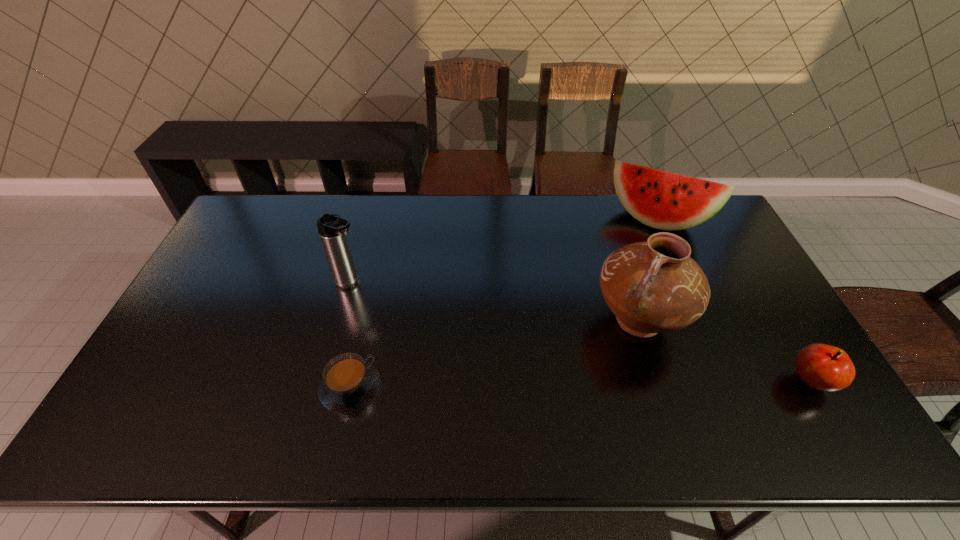
Locate an element on the screen. This screenshot has height=540, width=960. apple located in the right edge section of the desktop is located at coordinates tap(823, 367).

At what (x,y) coordinates should I click in order to perform the action: click on watermelon located at the right edge. Please return your answer as a coordinate pair (x, y). Looking at the image, I should click on (663, 200).

This screenshot has height=540, width=960. What are the coordinates of `object at the far right corner` in the screenshot? It's located at (663, 200).

Locate an element on the screen. The height and width of the screenshot is (540, 960). object that is at the near right corner is located at coordinates (823, 367).

This screenshot has width=960, height=540. I want to click on free space at the far edge, so click(x=288, y=234).

At what (x,y) coordinates should I click in order to perform the action: click on vacant space at the near edge. Please return your answer as a coordinate pair (x, y). Looking at the image, I should click on (260, 376).

Identify the location of free space at the left edge of the desktop. (227, 300).

The height and width of the screenshot is (540, 960). I want to click on free space at the far left corner, so click(x=246, y=217).

This screenshot has height=540, width=960. I want to click on vacant space at the near left corner of the desktop, so click(x=180, y=384).

Find the location of `vacant space at the far right corner`. vacant space at the far right corner is located at coordinates (682, 230).